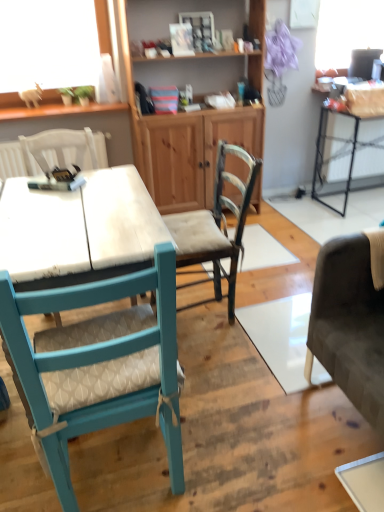
Question: Is wooden textured chair at center, positioned as the first chair in right-to-left order, turned away from white fabric chair at upper left, which is the third chair from right to left?

Choices:
 (A) no
 (B) yes

Answer: (A)

Question: Is wooden textured chair at center, arranged as the third chair when viewed from the left, positioned far away from white fabric chair at upper left, the first chair when ordered from left to right?

Choices:
 (A) no
 (B) yes

Answer: (A)

Question: Considering the relative sizes of wooden textured chair at center, arranged as the third chair when viewed from the left, and white fabric chair at upper left, the first chair when ordered from left to right, in the image provided, is wooden textured chair at center, arranged as the third chair when viewed from the left, thinner than white fabric chair at upper left, the first chair when ordered from left to right,?

Choices:
 (A) yes
 (B) no

Answer: (A)

Question: Is wooden textured chair at center, positioned as the first chair in right-to-left order, further to the viewer compared to white fabric chair at upper left, which is the third chair from right to left?

Choices:
 (A) no
 (B) yes

Answer: (A)

Question: From a real-world perspective, is wooden textured chair at center, positioned as the first chair in right-to-left order, physically below white fabric chair at upper left, which is the third chair from right to left?

Choices:
 (A) no
 (B) yes

Answer: (B)

Question: From a real-world perspective, is wooden textured chair at center, positioned as the first chair in right-to-left order, located higher than white fabric chair at upper left, the first chair when ordered from left to right?

Choices:
 (A) yes
 (B) no

Answer: (B)

Question: Is the position of wooden cabinet at center more distant than that of wooden textured chair at center, arranged as the third chair when viewed from the left?

Choices:
 (A) yes
 (B) no

Answer: (A)

Question: Is wooden textured chair at center, arranged as the third chair when viewed from the left, a part of wooden cabinet at center?

Choices:
 (A) yes
 (B) no

Answer: (B)

Question: Does wooden cabinet at center have a larger size compared to wooden textured chair at center, positioned as the first chair in right-to-left order?

Choices:
 (A) no
 (B) yes

Answer: (B)

Question: Is wooden cabinet at center oriented towards wooden textured chair at center, arranged as the third chair when viewed from the left?

Choices:
 (A) no
 (B) yes

Answer: (B)

Question: Is wooden cabinet at center shorter than wooden textured chair at center, positioned as the first chair in right-to-left order?

Choices:
 (A) yes
 (B) no

Answer: (B)

Question: Are wooden cabinet at center and wooden textured chair at center, arranged as the third chair when viewed from the left, beside each other?

Choices:
 (A) yes
 (B) no

Answer: (B)

Question: Does wooden textured chair at center, arranged as the third chair when viewed from the left, have a lesser width compared to metallic black table at right?

Choices:
 (A) no
 (B) yes

Answer: (A)